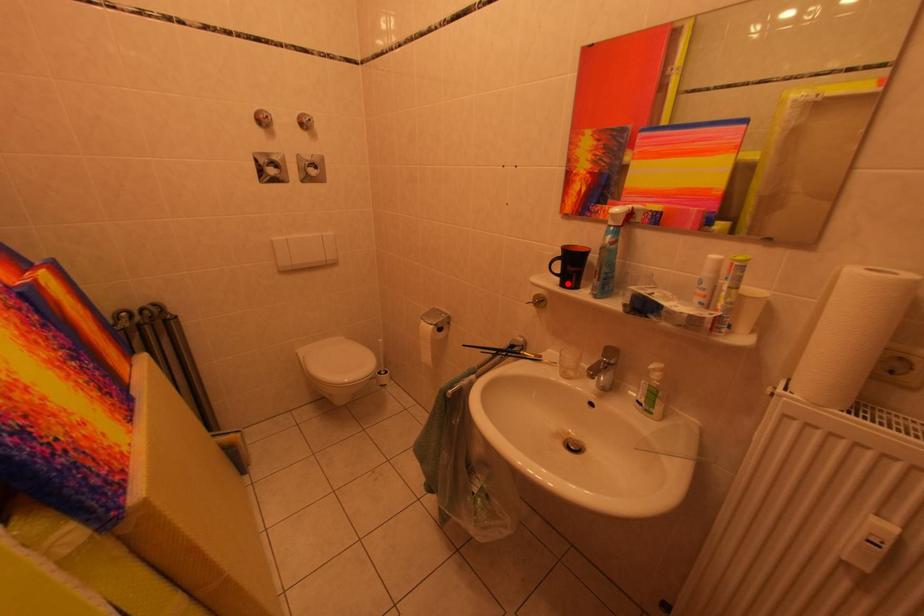
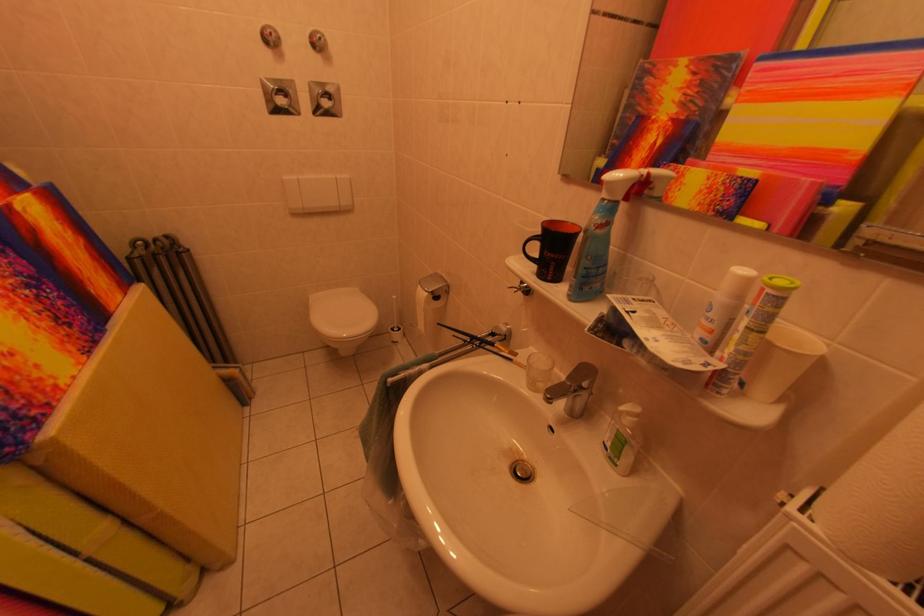
Find the pixel in the second image that matches the highlighted location in the first image.

(543, 270)